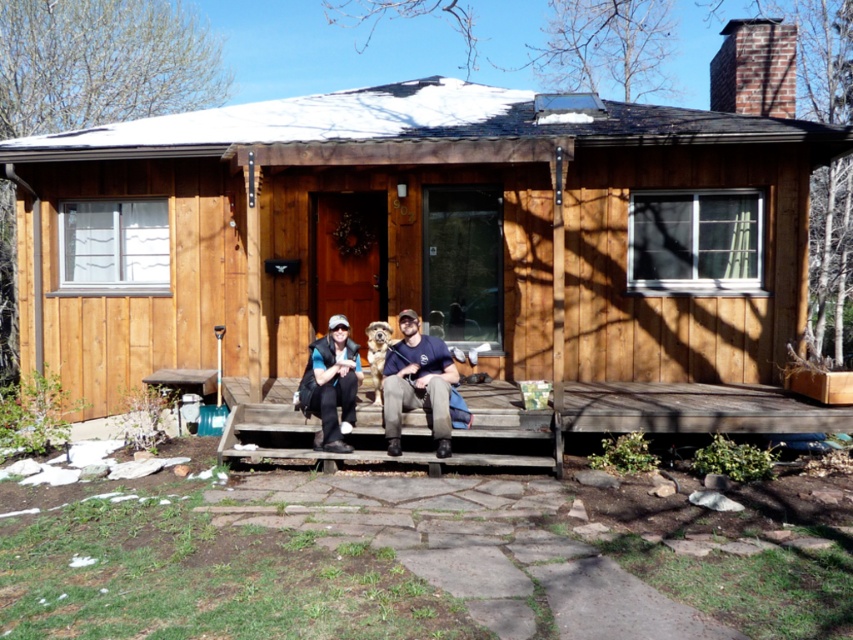
Question: Which object appears closest to the camera in this image?

Choices:
 (A) dark blue t-shirt at center
 (B) blue denim jacket at center
 (C) blue fabric jacket at center

Answer: (C)

Question: Does wooden cabin at center appear under wooden bench at center?

Choices:
 (A) yes
 (B) no

Answer: (B)

Question: Can you confirm if wooden bench at center is positioned to the right of dark blue t-shirt at center?

Choices:
 (A) yes
 (B) no

Answer: (A)

Question: Which object is closer to the camera taking this photo?

Choices:
 (A) blue fabric jacket at center
 (B) blue denim jacket at center
 (C) dark blue t-shirt at center

Answer: (A)

Question: Estimate the real-world distances between objects in this image. Which object is closer to the blue denim jacket at center?

Choices:
 (A) dark blue t-shirt at center
 (B) wooden bench at center
 (C) wooden cabin at center

Answer: (A)

Question: Does blue fabric jacket at center have a lesser width compared to dark blue t-shirt at center?

Choices:
 (A) yes
 (B) no

Answer: (B)